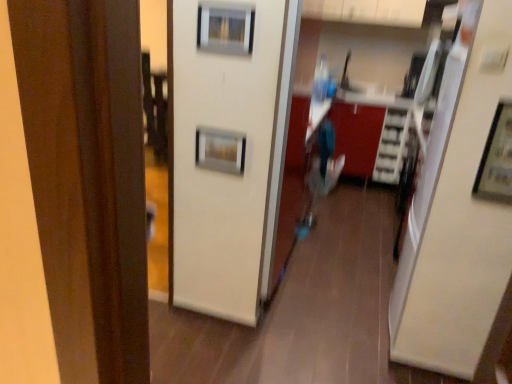
Question: From the image's perspective, is metallic silver picture frame at center, the 3th picture frame viewed from the front, under metallic silver picture frame at upper right, the third picture frame positioned from the back?

Choices:
 (A) yes
 (B) no

Answer: (B)

Question: Is metallic silver picture frame at upper right, the first picture frame in the front-to-back sequence, located within metallic silver picture frame at center, the second picture frame in the bottom-to-top sequence?

Choices:
 (A) no
 (B) yes

Answer: (A)

Question: Is metallic silver picture frame at center, the 1th picture frame when ordered from left to right, not close to metallic silver picture frame at upper right, which is the 3th picture frame in left-to-right order?

Choices:
 (A) yes
 (B) no

Answer: (A)

Question: Considering the relative sizes of metallic silver picture frame at center, the 3th picture frame viewed from the front, and metallic silver picture frame at upper right, positioned as the third picture frame in top-to-bottom order, in the image provided, is metallic silver picture frame at center, the 3th picture frame viewed from the front, shorter than metallic silver picture frame at upper right, positioned as the third picture frame in top-to-bottom order,?

Choices:
 (A) yes
 (B) no

Answer: (A)

Question: Is metallic silver picture frame at center, the second picture frame in the bottom-to-top sequence, completely or partially outside of metallic silver picture frame at upper right, positioned as the third picture frame in top-to-bottom order?

Choices:
 (A) no
 (B) yes

Answer: (B)

Question: Is metallic silver picture frame at center, the second picture frame in the bottom-to-top sequence, with metallic silver picture frame at upper right, which is the 3th picture frame in left-to-right order?

Choices:
 (A) no
 (B) yes

Answer: (A)

Question: Is metallic silver picture frame at upper center, placed as the second picture frame when sorted from back to front, oriented towards metallic silver picture frame at center, the third picture frame viewed from the right?

Choices:
 (A) no
 (B) yes

Answer: (A)

Question: Is metallic silver picture frame at upper center, which ranks as the first picture frame in top-to-bottom order, in contact with metallic silver picture frame at center, the 1th picture frame when ordered from left to right?

Choices:
 (A) no
 (B) yes

Answer: (A)

Question: Considering the relative positions of metallic silver picture frame at upper center, the 2th picture frame when ordered from front to back, and metallic silver picture frame at center, the second picture frame in the bottom-to-top sequence, in the image provided, is metallic silver picture frame at upper center, the 2th picture frame when ordered from front to back, to the left of metallic silver picture frame at center, the second picture frame in the bottom-to-top sequence, from the viewer's perspective?

Choices:
 (A) no
 (B) yes

Answer: (A)

Question: From the image's perspective, is metallic silver picture frame at upper center, which ranks as the first picture frame in top-to-bottom order, above metallic silver picture frame at center, the second picture frame in the bottom-to-top sequence?

Choices:
 (A) no
 (B) yes

Answer: (B)

Question: Is metallic silver picture frame at upper center, the second picture frame in the left-to-right sequence, smaller than metallic silver picture frame at center, the 3th picture frame viewed from the front?

Choices:
 (A) yes
 (B) no

Answer: (B)

Question: Is metallic silver picture frame at upper center, placed as the 2th picture frame when sorted from right to left, bigger than metallic silver picture frame at center, the third picture frame viewed from the right?

Choices:
 (A) yes
 (B) no

Answer: (A)

Question: From a real-world perspective, does metallic silver picture frame at upper right, the third picture frame positioned from the back, sit lower than metallic silver picture frame at upper center, the second picture frame in the left-to-right sequence?

Choices:
 (A) yes
 (B) no

Answer: (A)